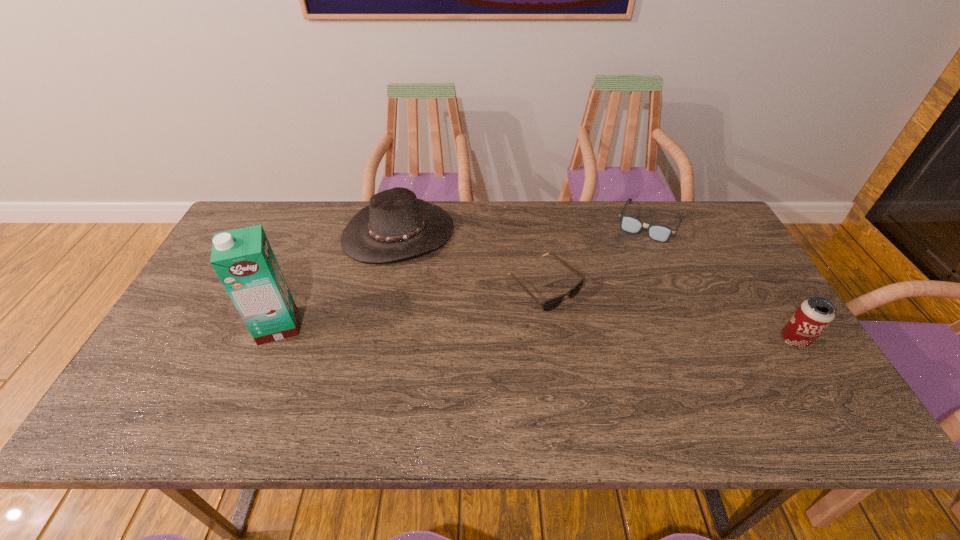
What are the coordinates of `spectacles at the far edge` in the screenshot? It's located at (660, 233).

Where is `beer can located in the right edge section of the desktop`? Image resolution: width=960 pixels, height=540 pixels. beer can located in the right edge section of the desktop is located at coordinates (813, 316).

The height and width of the screenshot is (540, 960). Identify the location of spectacles that is at the right edge. (660, 233).

Identify the location of object that is at the far right corner. The height and width of the screenshot is (540, 960). (660, 233).

The width and height of the screenshot is (960, 540). In the image, there is a desktop. Identify the location of vacant space at the far edge. (494, 222).

At what (x,y) coordinates should I click in order to perform the action: click on vacant space at the near edge. Please return your answer as a coordinate pair (x, y). Looking at the image, I should click on (502, 387).

Identify the location of vacant space at the right edge. This screenshot has height=540, width=960. pos(708,281).

The image size is (960, 540). What are the coordinates of `vacant space at the far left corner` in the screenshot? It's located at (281, 202).

In the image, there is a desktop. Where is `vacant space at the near left corner`? This screenshot has height=540, width=960. vacant space at the near left corner is located at coordinates (159, 365).

Where is `free region at the far right corner`? free region at the far right corner is located at coordinates (728, 233).